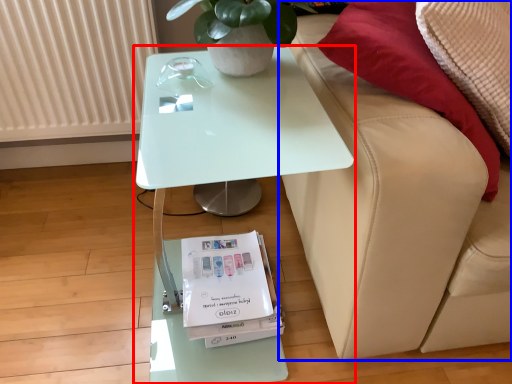
Question: Which point is further to the camera, table (highlighted by a red box) or studio couch (highlighted by a blue box)?

Choices:
 (A) table
 (B) studio couch

Answer: (A)